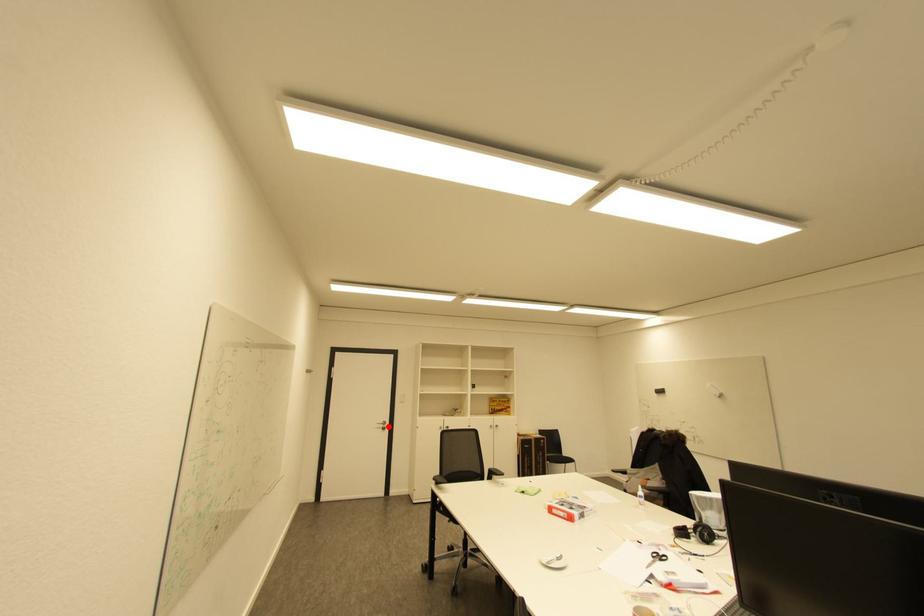
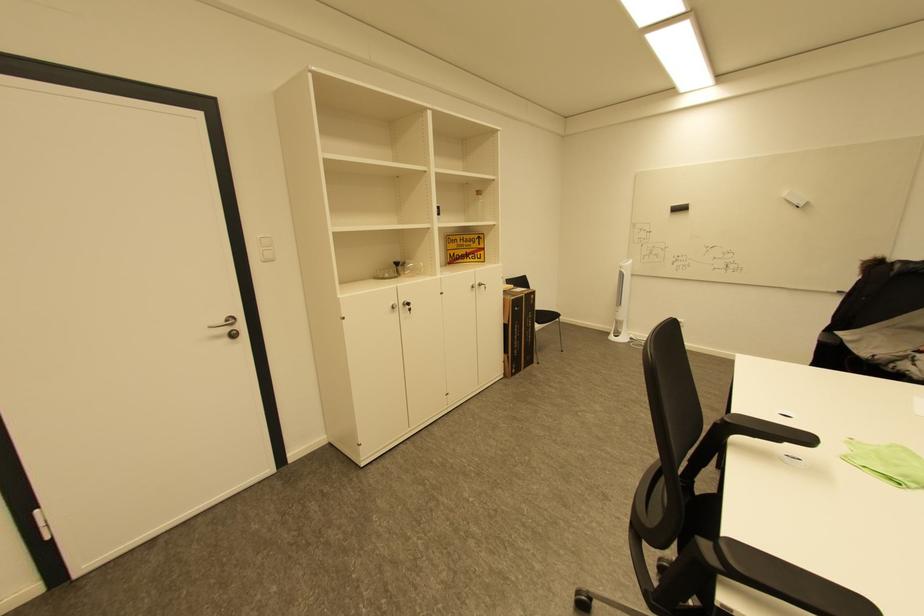
Question: I am providing you with two images of the same scene from different viewpoints. A red point is shown in image1. For the corresponding object point in image2, is it positioned nearer or farther from the camera?

Choices:
 (A) Nearer
 (B) Farther

Answer: (A)